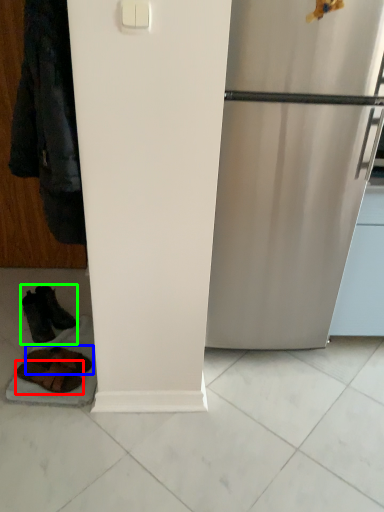
Question: Based on their relative distances, which object is farther from footwear (highlighted by a red box)? Choose from footwear (highlighted by a blue box) and footwear (highlighted by a green box).

Choices:
 (A) footwear
 (B) footwear

Answer: (B)